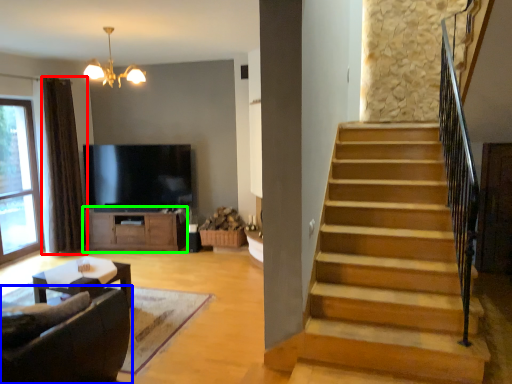
Question: Estimate the real-world distances between objects in this image. Which object is farther from curtain (highlighted by a red box), studio couch (highlighted by a blue box) or cabinetry (highlighted by a green box)?

Choices:
 (A) studio couch
 (B) cabinetry

Answer: (A)